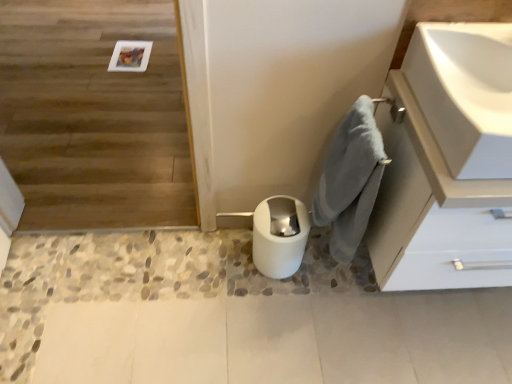
Question: From a real-world perspective, is wooden floor at upper left positioned under gray fluffy bath towel at lower right based on gravity?

Choices:
 (A) yes
 (B) no

Answer: (B)

Question: Is wooden floor at upper left positioned before gray fluffy bath towel at lower right?

Choices:
 (A) yes
 (B) no

Answer: (A)

Question: Is wooden floor at upper left at the left side of gray fluffy bath towel at lower right?

Choices:
 (A) yes
 (B) no

Answer: (A)

Question: Can you confirm if wooden floor at upper left is thinner than gray fluffy bath towel at lower right?

Choices:
 (A) yes
 (B) no

Answer: (B)

Question: Is wooden floor at upper left in contact with gray fluffy bath towel at lower right?

Choices:
 (A) no
 (B) yes

Answer: (A)

Question: Based on their sizes in the image, would you say white matte cabinet at upper right is bigger or smaller than wooden floor at upper left?

Choices:
 (A) big
 (B) small

Answer: (B)

Question: From a real-world perspective, is white matte cabinet at upper right positioned above or below wooden floor at upper left?

Choices:
 (A) above
 (B) below

Answer: (A)

Question: From the image's perspective, is white matte cabinet at upper right located above or below wooden floor at upper left?

Choices:
 (A) below
 (B) above

Answer: (A)

Question: Is point (375, 119) closer or farther from the camera than point (31, 24)?

Choices:
 (A) closer
 (B) farther

Answer: (A)

Question: Considering the positions of white glossy toilet bowl at lower center and wooden floor at upper left in the image, is white glossy toilet bowl at lower center wider or thinner than wooden floor at upper left?

Choices:
 (A) wide
 (B) thin

Answer: (B)

Question: Visually, is white glossy toilet bowl at lower center positioned to the left or to the right of wooden floor at upper left?

Choices:
 (A) left
 (B) right

Answer: (B)

Question: Looking at the image, does white glossy toilet bowl at lower center seem bigger or smaller compared to wooden floor at upper left?

Choices:
 (A) small
 (B) big

Answer: (A)

Question: Is white glossy toilet bowl at lower center in front of or behind wooden floor at upper left in the image?

Choices:
 (A) front
 (B) behind

Answer: (B)

Question: Do you think white glossy toilet bowl at lower center is within white glossy sink at upper right, or outside of it?

Choices:
 (A) outside
 (B) inside

Answer: (A)

Question: In terms of size, does white glossy toilet bowl at lower center appear bigger or smaller than white glossy sink at upper right?

Choices:
 (A) big
 (B) small

Answer: (B)